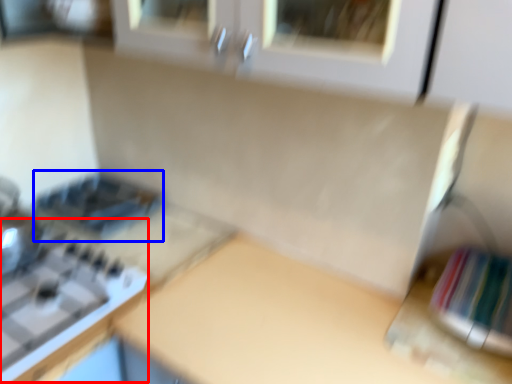
Question: Which object is further to the camera taking this photo, gas stove (highlighted by a red box) or appliance (highlighted by a blue box)?

Choices:
 (A) gas stove
 (B) appliance

Answer: (B)